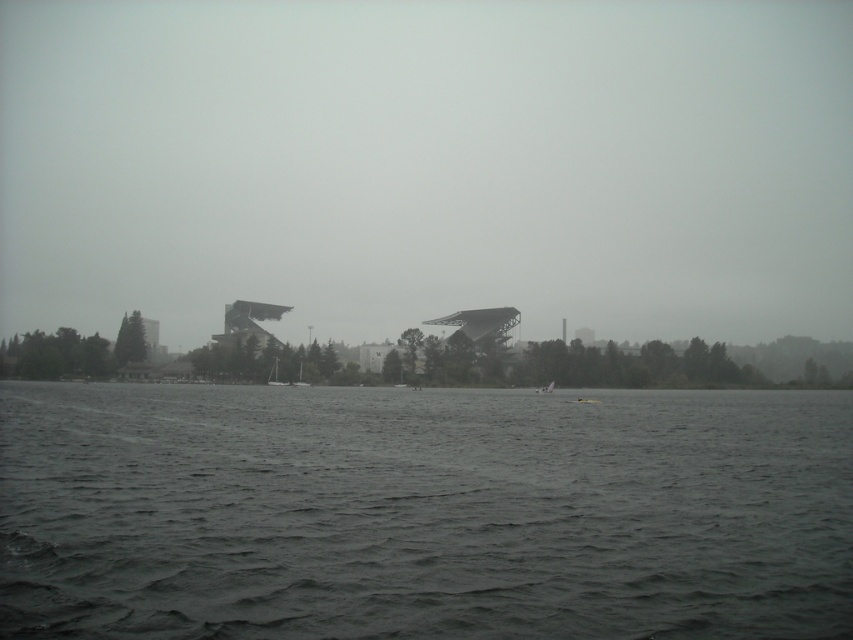
Can you confirm if white plastic sailboat at center is bigger than white matte sailboat at center?

Yes, white plastic sailboat at center is bigger than white matte sailboat at center.

Find the location of a particular element. Image resolution: width=853 pixels, height=640 pixels. white plastic sailboat at center is located at coordinates (276, 376).

Does foggy sky at center have a larger size compared to dark gray water at center?

Yes.

Locate an element on the screen. Image resolution: width=853 pixels, height=640 pixels. foggy sky at center is located at coordinates (428, 164).

Between foggy sky at center and white plastic boat at center, which one appears on the left side from the viewer's perspective?

Positioned to the left is foggy sky at center.

Who is higher up, foggy sky at center or white plastic boat at center?

foggy sky at center is higher up.

Is point (426, 90) in front of point (554, 384)?

No, it is behind (554, 384).

Identify the location of foggy sky at center. (428, 164).